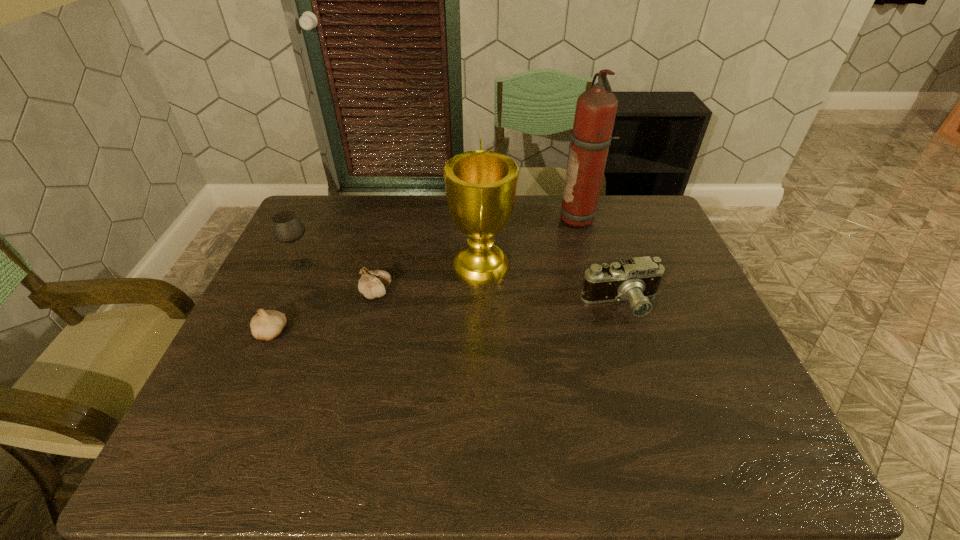
Where is `vacant space at the far right corner of the desktop`? Image resolution: width=960 pixels, height=540 pixels. vacant space at the far right corner of the desktop is located at coordinates (643, 207).

Where is `empty space that is in between the wineglass and the nearer garlic`? The image size is (960, 540). empty space that is in between the wineglass and the nearer garlic is located at coordinates (286, 299).

Locate an element on the screen. The width and height of the screenshot is (960, 540). unoccupied area between the second tallest object and the fourth shortest object is located at coordinates (391, 266).

I want to click on free space between the tallest object and the camera, so click(601, 261).

Locate an element on the screen. The width and height of the screenshot is (960, 540). free space between the right garlic and the nearer garlic is located at coordinates (324, 312).

Locate an element on the screen. The width and height of the screenshot is (960, 540). vacant space that's between the right garlic and the camera is located at coordinates (498, 298).

Find the location of a particular element. free space between the tallest object and the fourth object from left to right is located at coordinates (531, 242).

This screenshot has height=540, width=960. Find the location of `empty location between the shortest object and the fourth object from right to left`. empty location between the shortest object and the fourth object from right to left is located at coordinates (324, 312).

At what (x,y) coordinates should I click in order to perform the action: click on empty space that is in between the tallest object and the third object from right to left. Please return your answer as a coordinate pair (x, y). Looking at the image, I should click on [531, 242].

Find the location of a particular element. This screenshot has height=540, width=960. the fourth closest object to the left garlic is located at coordinates pos(636,279).